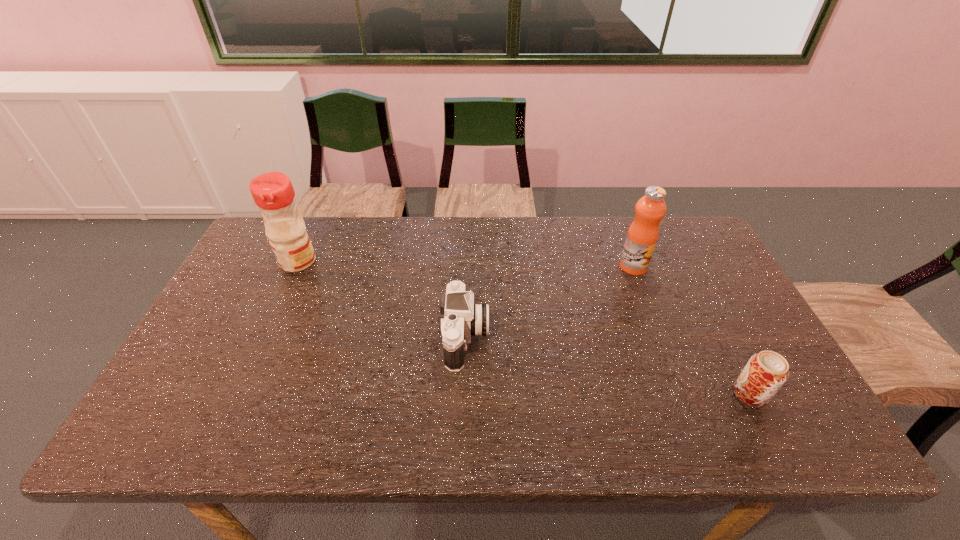
This screenshot has width=960, height=540. Find the location of `condiment situated at the far edge`. condiment situated at the far edge is located at coordinates (273, 193).

Find the location of a particular element. The width and height of the screenshot is (960, 540). fruit juice present at the far edge is located at coordinates (643, 233).

You are a GUI agent. You are given a task and a screenshot of the screen. Output one action in this format:
    pyautogui.click(x=<x>, y=<y>)
    Task: Click on the object that is at the left edge
    The width and height of the screenshot is (960, 540).
    Given the screenshot: What is the action you would take?
    pyautogui.click(x=273, y=193)

Find the location of a particular element. This screenshot has width=960, height=540. object present at the right edge is located at coordinates (764, 374).

Find the location of a particular element. The height and width of the screenshot is (540, 960). object present at the far left corner is located at coordinates (273, 193).

Identify the location of vacant space at the far edge. The image size is (960, 540). (371, 221).

This screenshot has width=960, height=540. In the image, there is a desktop. Identify the location of vacant region at the near edge. (224, 430).

The width and height of the screenshot is (960, 540). I want to click on vacant space at the right edge of the desktop, so point(753,353).

Where is `vacant space in between the leftmost object and the third object from left to right`? vacant space in between the leftmost object and the third object from left to right is located at coordinates (466, 264).

I want to click on vacant region between the nearest object and the camera, so click(x=608, y=366).